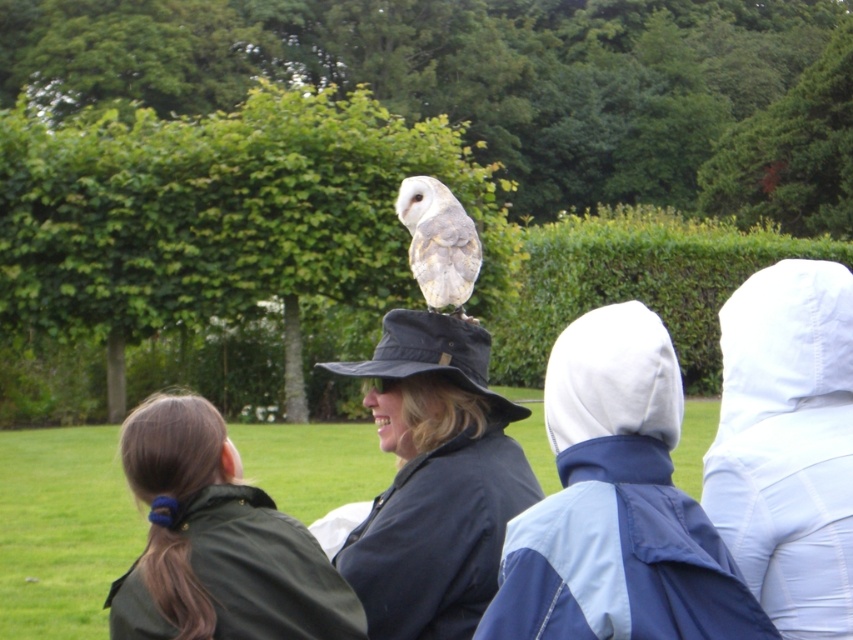
Looking at this image, you are a photographer trying to capture a clear shot of the matte black hat at center without the white fabric hood at center blocking it. What adjustment should you make to your camera angle?

The white fabric hood at center is in front of the matte black hat at center, so you should adjust your camera angle to position it behind the white fabric hood at center to ensure the matte black hat at center is visible.